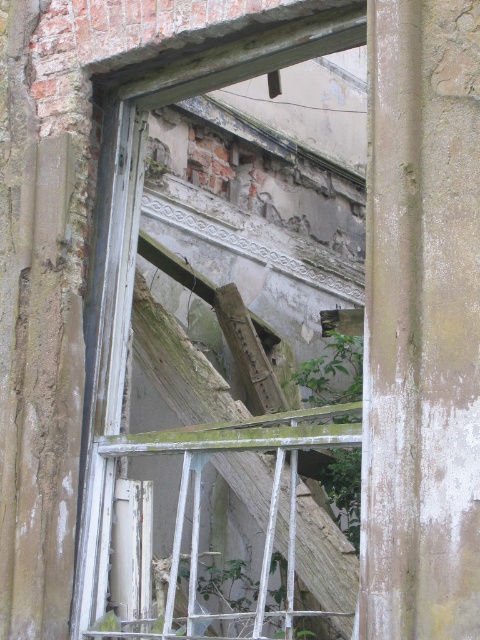
You are a painter standing at the base of the wall with a ladder that can extend up to 15 feet. You need to paint the white painted wood window frame at center. Can you reach it with your ladder?

The white painted wood window frame at center is 50.98 feet away from the painter, which is much higher than the ladder can reach. You will need a taller ladder or another method to reach it.

You are a contractor assessing the damage to the building. You notice a point at coordinates (x=134, y=252). What object is located at this point?

The white painted wood window frame at center is located at point (x=134, y=252).

You are a maintenance worker who needs to reach both the white painted wood window frame at center and the green leafy plant at center. If your ladder can extend up to 6 meters, which object can you safely reach with the ladder?

The distance between the white painted wood window frame at center and the green leafy plant at center is 6.24 meters. Since your ladder can only extend up to 6 meters, you cannot safely reach either object with the ladder as the distance exceeds the ladder length.